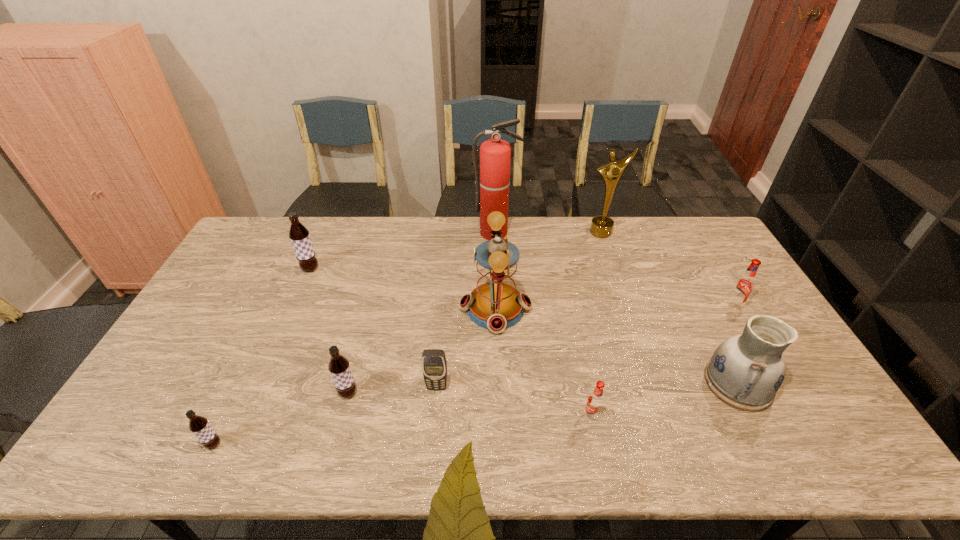
The width and height of the screenshot is (960, 540). Identify the location of red fire extinguisher. (495, 154).

The image size is (960, 540). I want to click on the tallest object, so click(x=495, y=154).

Where is `the eighth object from left to right`? The image size is (960, 540). the eighth object from left to right is located at coordinates (601, 226).

At what (x,y) coordinates should I click in order to perform the action: click on the third tallest object. Please return your answer as a coordinate pair (x, y). This screenshot has height=540, width=960. Looking at the image, I should click on (495, 304).

At what (x,y) coordinates should I click in order to perform the action: click on the biggest brown root beer. Please return your answer as a coordinate pair (x, y). The image size is (960, 540). Looking at the image, I should click on (299, 235).

Where is `the tallest root beer`? The width and height of the screenshot is (960, 540). the tallest root beer is located at coordinates (299, 235).

In order to click on pottery in this screenshot , I will do `click(746, 370)`.

You are a GUI agent. You are given a task and a screenshot of the screen. Output one action in this format:
    pyautogui.click(x=<x>, y=<y>)
    Task: Click on the bigger red root beer
    The image size is (960, 540).
    Given the screenshot: What is the action you would take?
    pyautogui.click(x=743, y=286)

Find the location of a particular element. The height and width of the screenshot is (540, 960). the rightmost root beer is located at coordinates (743, 286).

Where is `the rightmost brown root beer`? The height and width of the screenshot is (540, 960). the rightmost brown root beer is located at coordinates (339, 367).